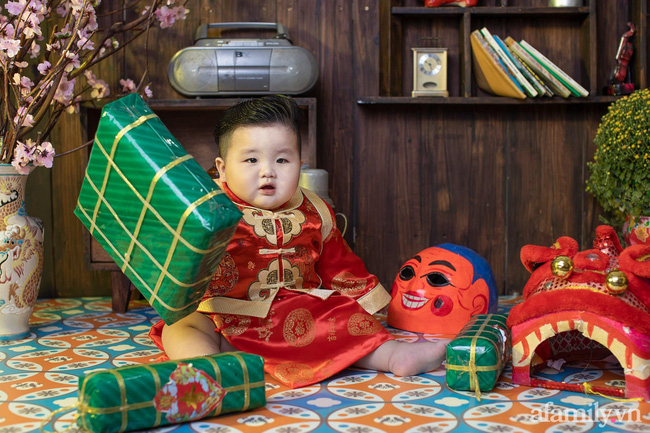
Where is `wall`? The image size is (650, 433). wall is located at coordinates (444, 151).